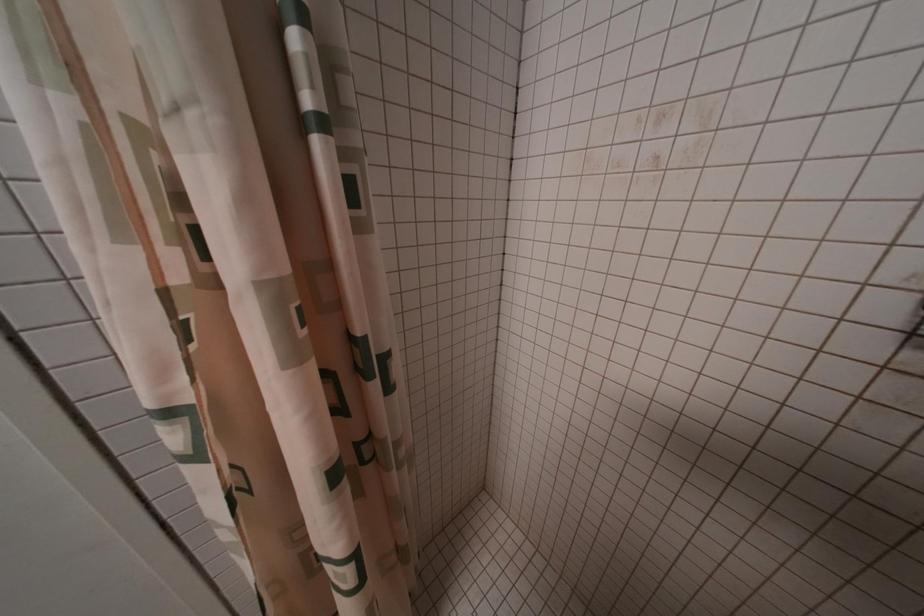
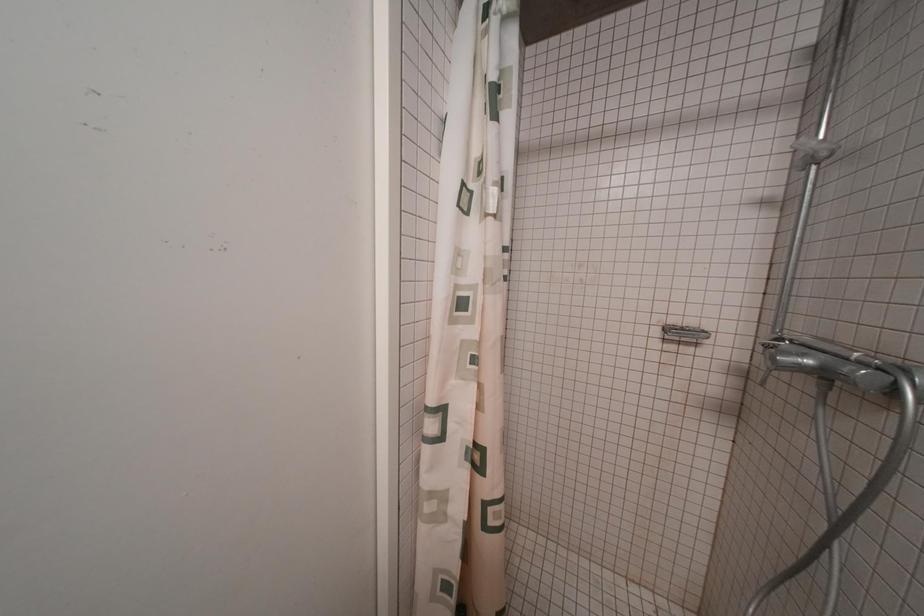
The images are taken continuously from a first-person perspective. In which direction are you moving?

The cameraman walked toward left, backward.